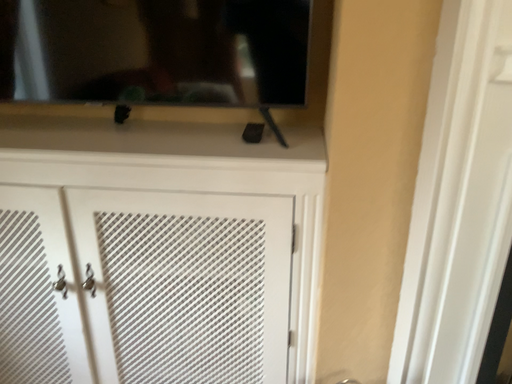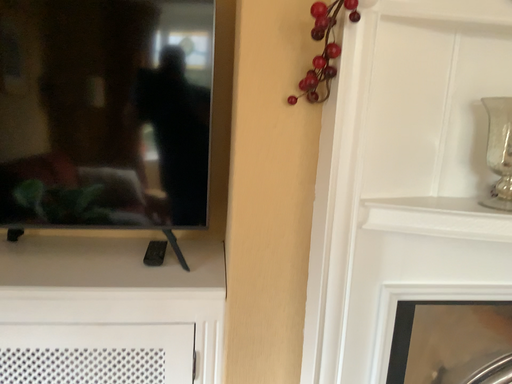
Question: Which way did the camera rotate in the video?

Choices:
 (A) rotated downward
 (B) rotated upward

Answer: (B)